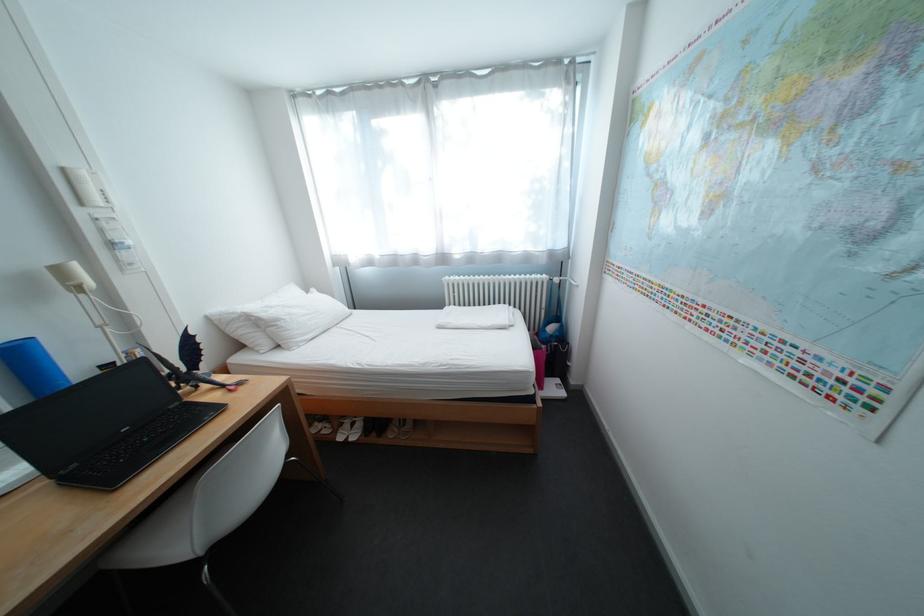
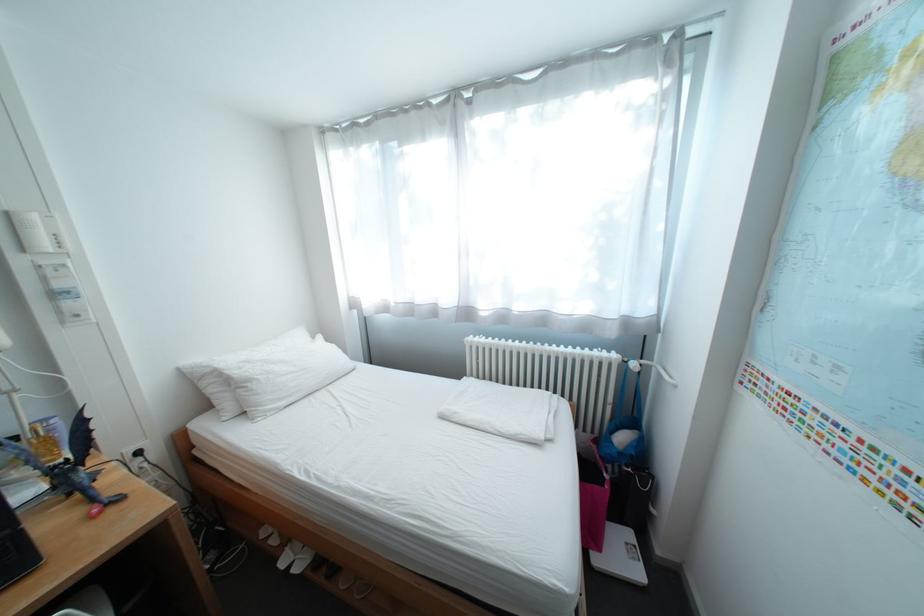
Locate, in the second image, the point that corresponds to point (568, 331) in the first image.

(642, 447)